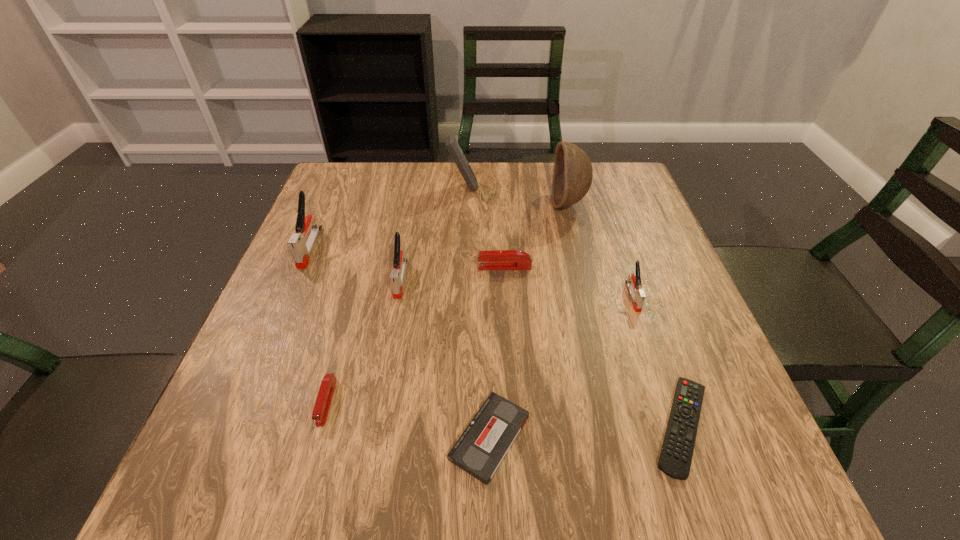
Where is `bowl`? bowl is located at coordinates (572, 176).

Find the location of a particular element. Image resolution: width=960 pixels, height=540 pixels. calculator is located at coordinates (451, 143).

Where is `the tallest stapler`? The width and height of the screenshot is (960, 540). the tallest stapler is located at coordinates (301, 250).

At what (x,y) coordinates should I click in order to perform the action: click on the leftmost gray stapler. Please return your answer as a coordinate pair (x, y). This screenshot has height=540, width=960. Looking at the image, I should click on (301, 250).

Locate an element on the screen. This screenshot has width=960, height=540. the second biggest gray stapler is located at coordinates (397, 274).

This screenshot has height=540, width=960. I want to click on the fourth shortest stapler, so click(x=397, y=274).

Identify the location of the rightmost stapler. This screenshot has height=540, width=960. (634, 285).

Where is `the smallest gray stapler`? The image size is (960, 540). the smallest gray stapler is located at coordinates tap(634, 285).

Locate an element on the screen. This screenshot has width=960, height=540. the sixth tallest object is located at coordinates (497, 259).

Identify the location of the second stapler from right to left. This screenshot has height=540, width=960. (497, 259).